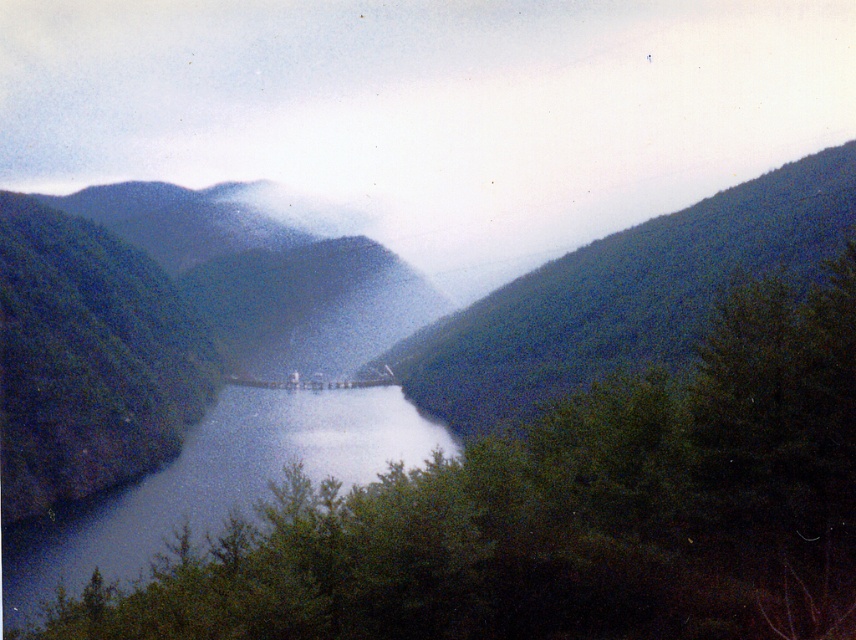
Question: Which object appears farthest from the camera in this image?

Choices:
 (A) green textured hillside at center
 (B) blue glassy lake at center
 (C) green leafy tree at center

Answer: (A)

Question: Can you confirm if green matte mountain at center is positioned above blue glassy lake at center?

Choices:
 (A) no
 (B) yes

Answer: (B)

Question: Can you confirm if green textured hillside at center is smaller than blue glassy lake at center?

Choices:
 (A) no
 (B) yes

Answer: (A)

Question: Which object is the farthest from the green matte mountain at center?

Choices:
 (A) green leafy tree at center
 (B) blue glassy lake at center
 (C) green textured hillside at center

Answer: (A)

Question: Is green leafy tree at center in front of green textured hillside at center?

Choices:
 (A) yes
 (B) no

Answer: (A)

Question: Which point is farther from the camera taking this photo?

Choices:
 (A) (747, 253)
 (B) (343, 353)
 (C) (4, 538)

Answer: (B)